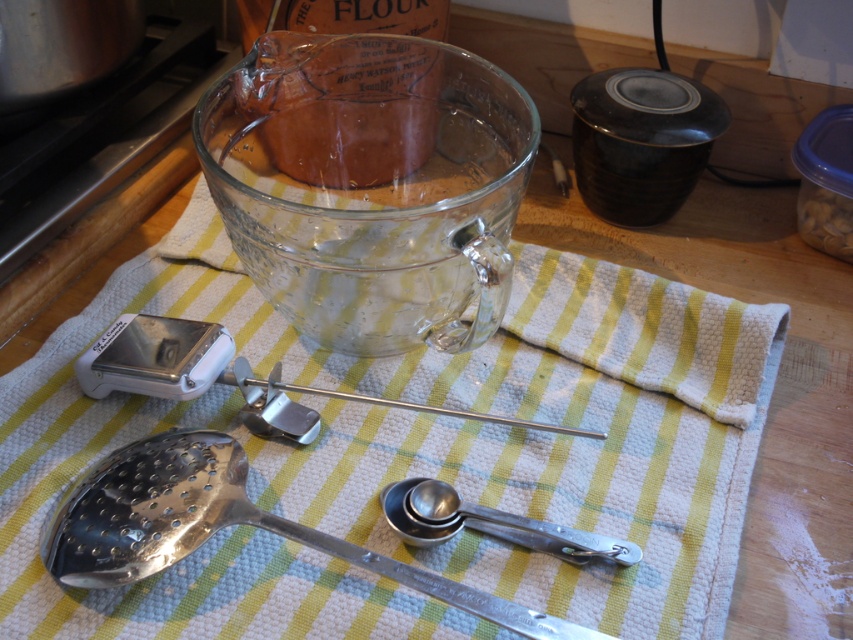
Which is behind, point (453, 586) or point (541, 524)?

The point (541, 524) is behind.

Is point (59, 561) farther from viewer compared to point (555, 534)?

No, (59, 561) is closer to viewer.

Where is `polished metal slotted spoon at lower left`? The width and height of the screenshot is (853, 640). polished metal slotted spoon at lower left is located at coordinates (218, 525).

I want to click on polished metal slotted spoon at lower left, so click(218, 525).

Which is in front, point (704, 312) or point (102, 586)?

Point (102, 586) is in front.

Is white woven cloth at center above polished metal slotted spoon at lower left?

Correct, white woven cloth at center is located above polished metal slotted spoon at lower left.

Locate an element on the screen. white woven cloth at center is located at coordinates (421, 460).

Is white woven cloth at center to the right of silver metallic measuring spoons at center from the viewer's perspective?

No, white woven cloth at center is not to the right of silver metallic measuring spoons at center.

Describe the element at coordinates (421, 460) in the screenshot. I see `white woven cloth at center` at that location.

Is point (173, 241) behind point (445, 508)?

Yes, it is.

Locate an element on the screen. white woven cloth at center is located at coordinates (421, 460).